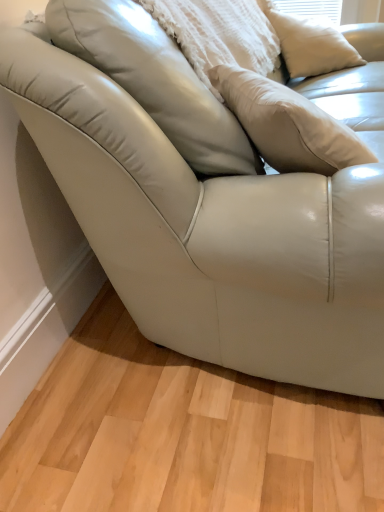
Question: Is white matte pillow at upper right, the first pillow from the right, thinner than matte white pillow at upper center, positioned as the 2th pillow in right-to-left order?

Choices:
 (A) no
 (B) yes

Answer: (B)

Question: From the image's perspective, is white matte pillow at upper right, the second pillow in the left-to-right sequence, on matte white pillow at upper center, the 1th pillow from the left?

Choices:
 (A) no
 (B) yes

Answer: (B)

Question: Considering the relative sizes of white matte pillow at upper right, the second pillow in the left-to-right sequence, and matte white pillow at upper center, the 1th pillow from the left, in the image provided, is white matte pillow at upper right, the second pillow in the left-to-right sequence, smaller than matte white pillow at upper center, the 1th pillow from the left,?

Choices:
 (A) no
 (B) yes

Answer: (B)

Question: Would you say white matte pillow at upper right, the second pillow in the left-to-right sequence, contains matte white pillow at upper center, the 1th pillow from the left?

Choices:
 (A) yes
 (B) no

Answer: (B)

Question: From a real-world perspective, is white matte pillow at upper right, the first pillow from the right, on top of matte white pillow at upper center, positioned as the 2th pillow in right-to-left order?

Choices:
 (A) no
 (B) yes

Answer: (A)

Question: Is white matte pillow at upper right, the second pillow in the left-to-right sequence, positioned beyond the bounds of matte white pillow at upper center, the 1th pillow from the left?

Choices:
 (A) yes
 (B) no

Answer: (A)

Question: Is matte white pillow at upper center, positioned as the 2th pillow in right-to-left order, facing towards white matte pillow at upper right, the first pillow from the right?

Choices:
 (A) yes
 (B) no

Answer: (A)

Question: Is matte white pillow at upper center, positioned as the 2th pillow in right-to-left order, in contact with white matte pillow at upper right, the first pillow from the right?

Choices:
 (A) no
 (B) yes

Answer: (A)

Question: Is matte white pillow at upper center, positioned as the 2th pillow in right-to-left order, far from white matte pillow at upper right, the second pillow in the left-to-right sequence?

Choices:
 (A) no
 (B) yes

Answer: (B)

Question: From the image's perspective, would you say matte white pillow at upper center, the 1th pillow from the left, is shown under white matte pillow at upper right, the first pillow from the right?

Choices:
 (A) no
 (B) yes

Answer: (B)

Question: Is the position of matte white pillow at upper center, the 1th pillow from the left, less distant than that of white matte pillow at upper right, the first pillow from the right?

Choices:
 (A) no
 (B) yes

Answer: (B)

Question: Is matte white pillow at upper center, the 1th pillow from the left, wider than white matte pillow at upper right, the first pillow from the right?

Choices:
 (A) yes
 (B) no

Answer: (A)

Question: In the image, is matte white pillow at upper center, positioned as the 2th pillow in right-to-left order, positioned in front of or behind white matte pillow at upper right, the first pillow from the right?

Choices:
 (A) front
 (B) behind

Answer: (A)